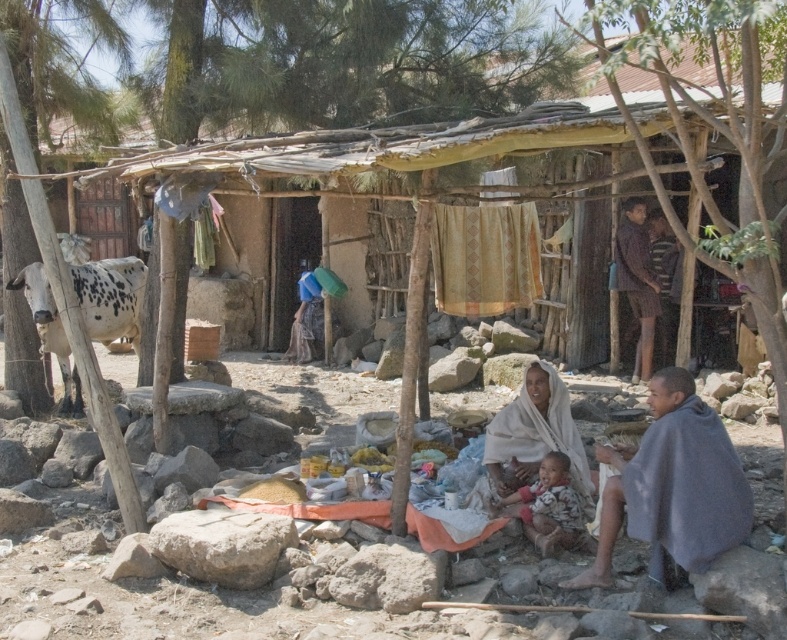
Is the position of gray woolen shawl at lower right more distant than that of gray rough rock at lower left?

That is False.

Looking at this image, does gray woolen shawl at lower right have a lesser height compared to gray rough rock at lower left?

In fact, gray woolen shawl at lower right may be taller than gray rough rock at lower left.

Measure the distance between point (648, 385) and camera.

The distance of point (648, 385) from camera is 34.15 feet.

Find the location of a particular element. gray woolen shawl at lower right is located at coordinates (671, 484).

Is point (627, 448) positioned before point (636, 305)?

Yes.

Can you confirm if gray woolen shawl at lower right is positioned to the left of striped shirt at upper right?

Indeed, gray woolen shawl at lower right is positioned on the left side of striped shirt at upper right.

The height and width of the screenshot is (640, 787). Identify the location of gray woolen shawl at lower right. (671, 484).

Is white cloth at center taller than striped shirt at upper right?

No.

Who is positioned more to the left, white cloth at center or striped shirt at upper right?

white cloth at center is more to the left.

Find the location of a particular element. The width and height of the screenshot is (787, 640). white cloth at center is located at coordinates (534, 435).